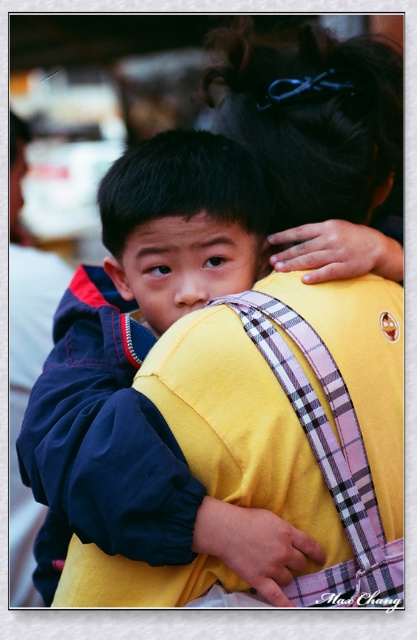
You are a photographer trying to capture a clear shot of both the dark blue fleece jacket at upper left and the plaid fabric backpack at upper center. Since the background is blurred, which object should you focus on first to ensure both are in focus?

The dark blue fleece jacket at upper left is positioned under the plaid fabric backpack at upper center, so focusing on the plaid fabric backpack at upper center first will ensure both are in focus as the jacket is closer to the camera.

You are a photographer trying to capture a closeup shot of the plaid fabric backpack at upper center. You have a camera with a 12 inch focus range. The dark blue fleece jacket at upper left is in the way. Can you adjust your position so that the backpack is within focus without the jacket blocking it?

The distance between the dark blue fleece jacket at upper left and the plaid fabric backpack at upper center is 14.79 inches. Since your camera has a 12 inch focus range, moving closer by approximately 2.79 inches would bring the backpack into focus while keeping the jacket out of the frame.